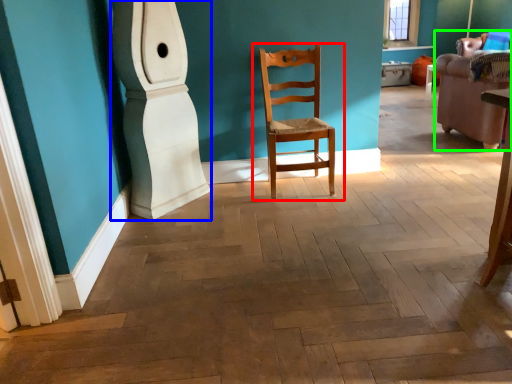
Question: Based on their relative distances, which object is farther from chair (highlighted by a red box)? Choose from pillar (highlighted by a blue box) and armchair (highlighted by a green box).

Choices:
 (A) pillar
 (B) armchair

Answer: (B)